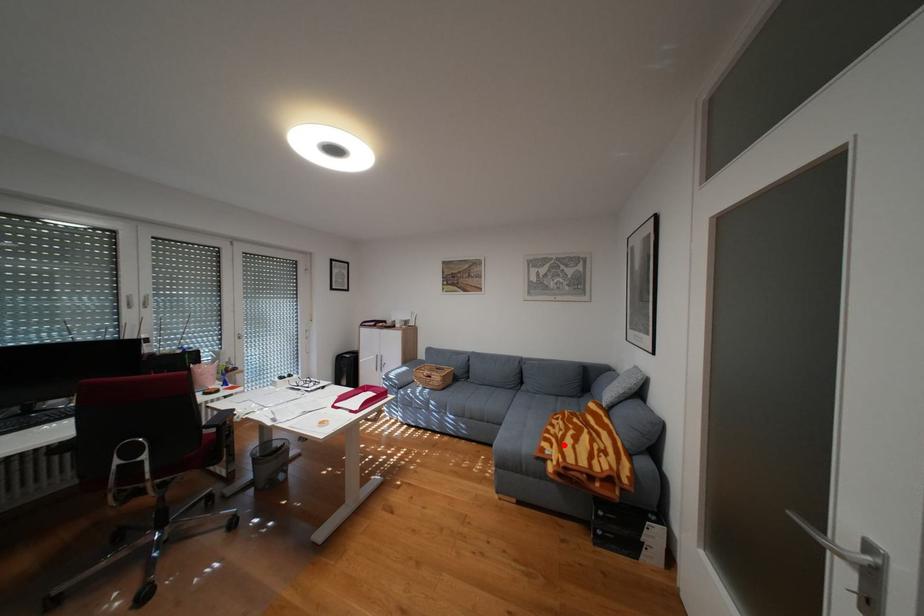
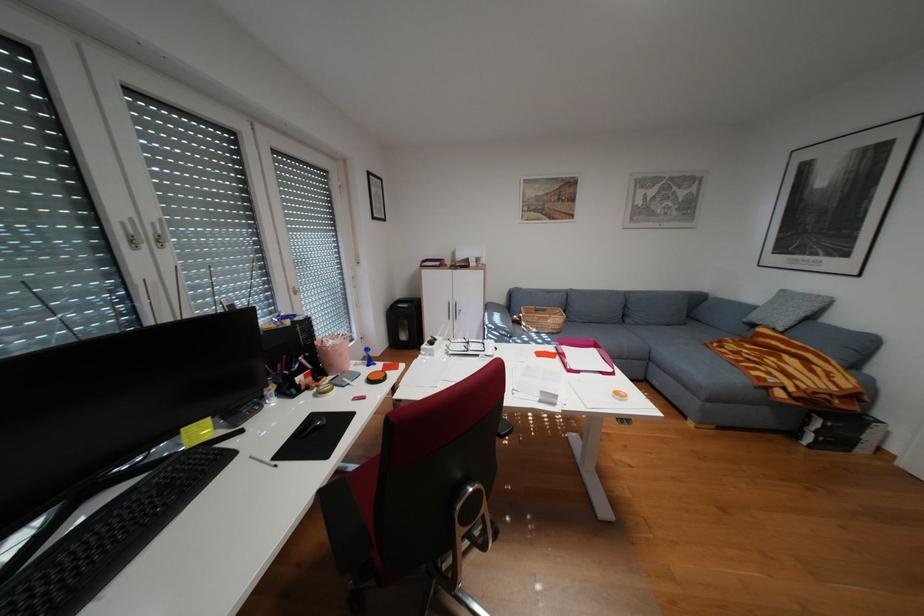
Find the pixel in the second image that matches the highlighted location in the first image.

(782, 373)